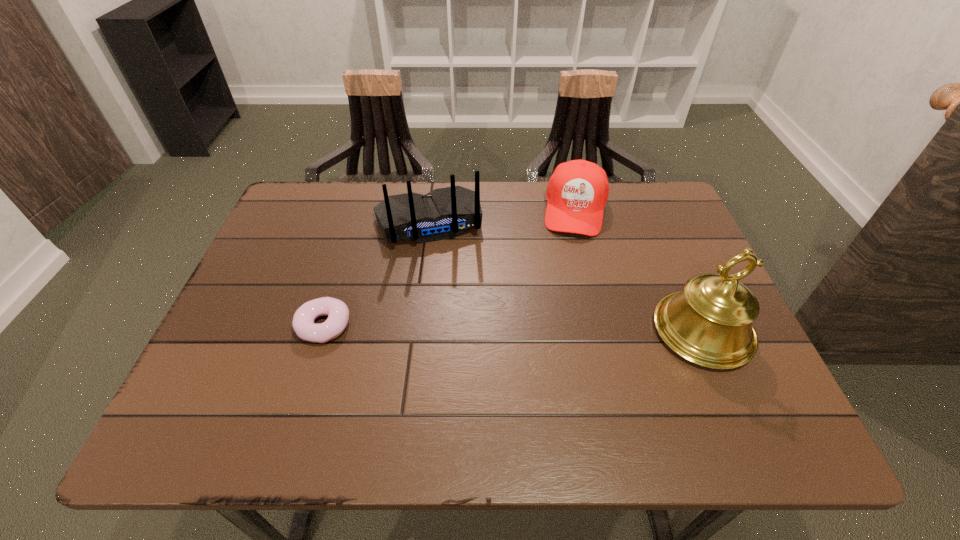
The image size is (960, 540). I want to click on free region that satisfies the following two spatial constraints: 1. on the front side of the bell; 2. on the right side of the baseball cap, so click(605, 331).